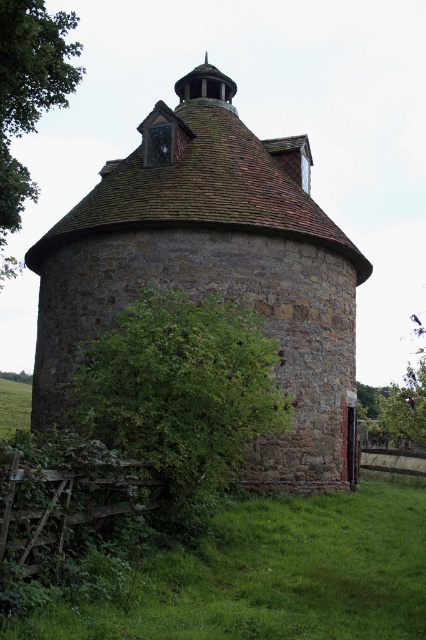
You are standing in the field in front of the brown stone silo at center and the green leafy bush at lower left. Which object is higher in elevation?

The brown stone silo at center is above the green leafy bush at lower left, so it is higher in elevation.

You are standing in a rural area and see the brown stone silo at center. If you want to take a photo of it with your smartphone, which has a maximum zoom range of 10 meters, will you be able to capture the entire structure without moving closer?

The brown stone silo at center is 16.45 meters away from you. Since your smartphone has a maximum zoom range of 10 meters, you will not be able to capture the entire structure without moving closer.

You are standing at the center of the image and want to walk towards the green leafy bush at lower left. What direction should you move in to reach it?

Since the green leafy bush at lower left is located at coordinates 0.611 on the x axis and 0.425 on the y axis, you should move towards the lower left direction to reach it.